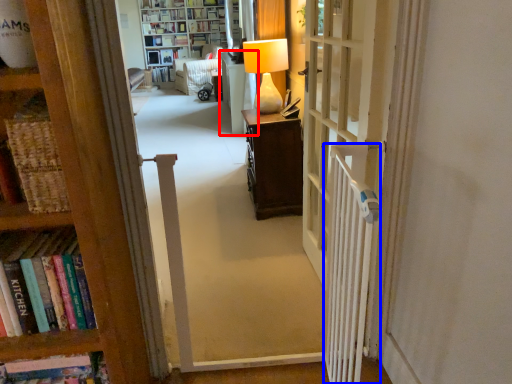
Question: Which object appears farthest to the camera in this image, furniture (highlighted by a red box) or radiator (highlighted by a blue box)?

Choices:
 (A) furniture
 (B) radiator

Answer: (A)